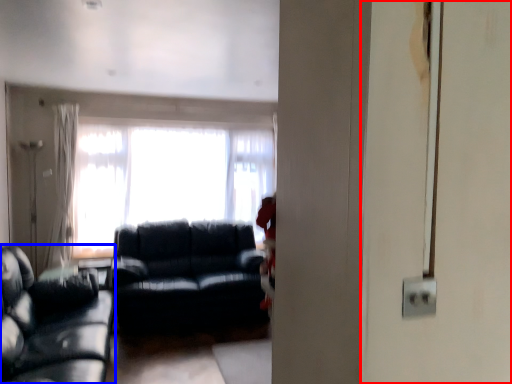
Question: Which object appears farthest to the camera in this image, screen door (highlighted by a red box) or studio couch (highlighted by a blue box)?

Choices:
 (A) screen door
 (B) studio couch

Answer: (A)